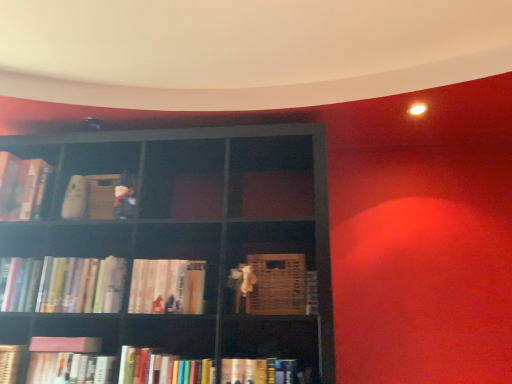
Question: From a real-world perspective, does hardcover books at lower center, positioned as the 8th book in left-to-right order, stand above hardcover book at lower left, which is the 5th book from left to right?

Choices:
 (A) yes
 (B) no

Answer: (A)

Question: Is hardcover book at lower left, acting as the 6th book starting from the right, at the back of hardcover books at lower center, the third book positioned from the right?

Choices:
 (A) yes
 (B) no

Answer: (B)

Question: Does hardcover books at lower center, positioned as the 8th book in left-to-right order, have a greater width compared to hardcover book at lower left, acting as the 6th book starting from the right?

Choices:
 (A) yes
 (B) no

Answer: (A)

Question: Is hardcover book at lower left, acting as the 6th book starting from the right, a part of hardcover books at lower center, the third book positioned from the right?

Choices:
 (A) no
 (B) yes

Answer: (A)

Question: Is hardcover books at lower center, positioned as the 8th book in left-to-right order, directly adjacent to hardcover book at lower left, which is the 5th book from left to right?

Choices:
 (A) no
 (B) yes

Answer: (A)

Question: Is hardcover books at lower center, the third book positioned from the right, in front of or behind hardcover book at lower center, which ranks as the second book in right-to-left order, in the image?

Choices:
 (A) behind
 (B) front

Answer: (A)

Question: From a real-world perspective, is hardcover books at lower center, positioned as the 8th book in left-to-right order, above or below hardcover book at lower center, which ranks as the second book in right-to-left order?

Choices:
 (A) below
 (B) above

Answer: (B)

Question: Based on their sizes in the image, would you say hardcover books at lower center, the third book positioned from the right, is bigger or smaller than hardcover book at lower center, the ninth book in the left-to-right sequence?

Choices:
 (A) big
 (B) small

Answer: (A)

Question: Do you think hardcover books at lower center, the third book positioned from the right, is within hardcover book at lower center, which ranks as the second book in right-to-left order, or outside of it?

Choices:
 (A) inside
 (B) outside

Answer: (B)

Question: From a real-world perspective, is hardcover book at lower left, which is the 5th book from left to right, physically located above or below hardcover books at lower center, positioned as the 8th book in left-to-right order?

Choices:
 (A) above
 (B) below

Answer: (B)

Question: Would you say hardcover book at lower left, which is the 5th book from left to right, is inside or outside hardcover books at lower center, positioned as the 8th book in left-to-right order?

Choices:
 (A) inside
 (B) outside

Answer: (B)

Question: Considering the positions of hardcover book at lower left, which is the 5th book from left to right, and hardcover books at lower center, the third book positioned from the right, in the image, is hardcover book at lower left, which is the 5th book from left to right, taller or shorter than hardcover books at lower center, the third book positioned from the right,?

Choices:
 (A) short
 (B) tall

Answer: (A)

Question: From the image's perspective, is hardcover book at lower left, acting as the 6th book starting from the right, positioned above or below hardcover books at lower center, positioned as the 8th book in left-to-right order?

Choices:
 (A) above
 (B) below

Answer: (B)

Question: Is point click(108, 306) positioned closer to the camera than point click(178, 274)?

Choices:
 (A) closer
 (B) farther

Answer: (A)

Question: From the image's perspective, is hardcover books at left, arranged as the 6th book when viewed from the left, above or below hardcover books at center, the 7th book from the left?

Choices:
 (A) below
 (B) above

Answer: (A)